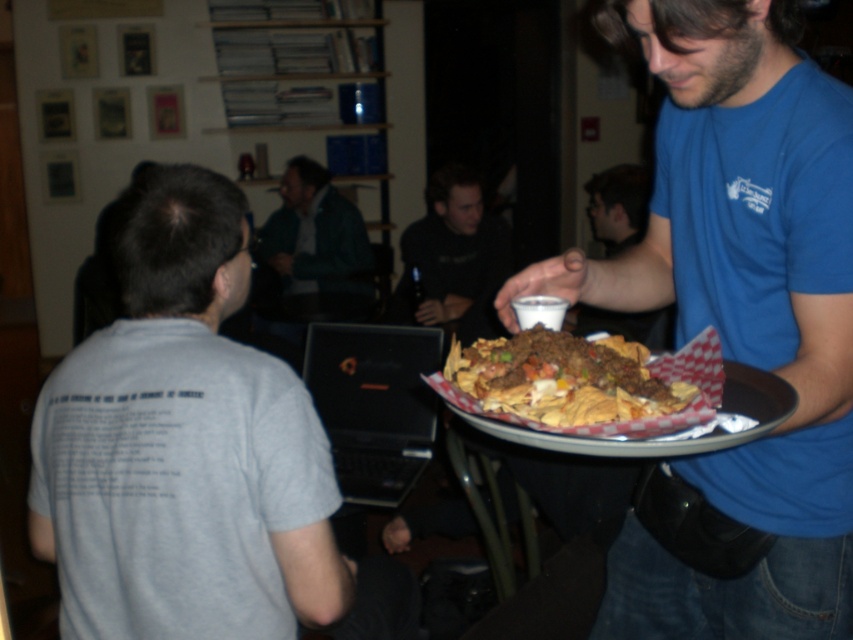
Question: Which point is closer to the camera taking this photo?

Choices:
 (A) (322, 385)
 (B) (672, 541)

Answer: (B)

Question: From the image, what is the correct spatial relationship of black matte laptop at center in relation to dark gray sweater at center?

Choices:
 (A) right
 (B) left

Answer: (B)

Question: Is gray cotton t-shirt at back to the right of matte black tray at center from the viewer's perspective?

Choices:
 (A) no
 (B) yes

Answer: (A)

Question: Is blue cotton shirt at upper right in front of crunchy tortilla chips with ground beef and vegetables at center?

Choices:
 (A) yes
 (B) no

Answer: (B)

Question: Considering the real-world distances, which object is closest to the green fuzzy sweater at upper center?

Choices:
 (A) matte black tray at center
 (B) black matte laptop at center
 (C) crunchy tortilla chips with ground beef and vegetables at center
 (D) blue cotton shirt at upper right

Answer: (A)

Question: Which point is closer to the camera taking this photo?

Choices:
 (A) (463, 332)
 (B) (299, 280)
 (C) (173, 612)
 (D) (627, 316)

Answer: (C)